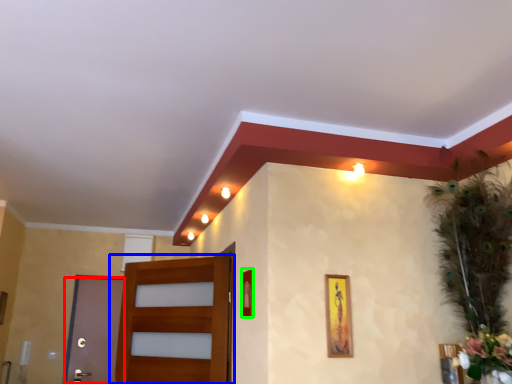
Question: Which object is positioned closest to door (highlighted by a red box)? Select from door (highlighted by a blue box) and picture frame (highlighted by a green box).

Choices:
 (A) door
 (B) picture frame

Answer: (A)